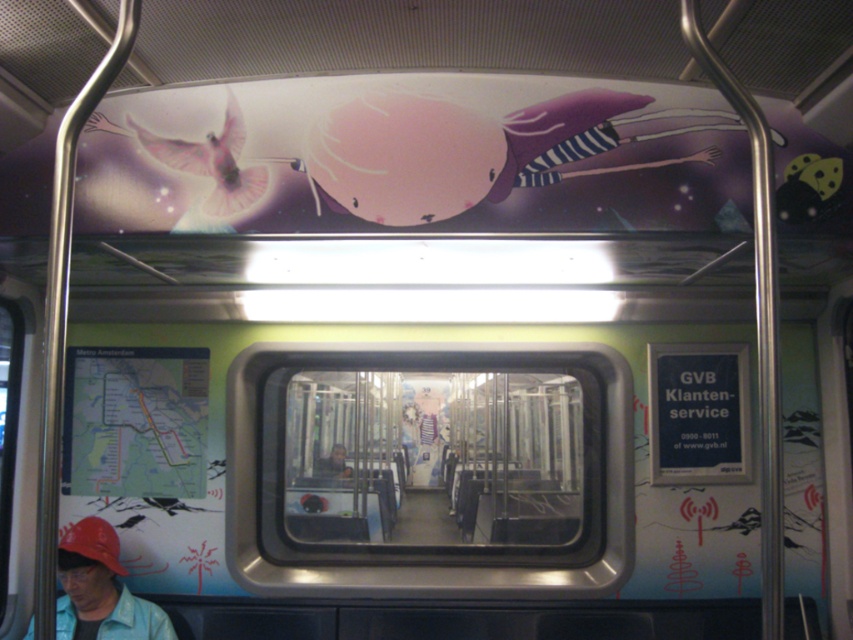
You are a passenger on the subway train and notice two items at the lower left corner. Which item is closer to you between the matte red hat at lower left and the matte red baseball cap at lower left?

The matte red hat at lower left is closer to you because it is in front of the matte red baseball cap at lower left.

You are a passenger on the subway train and want to find the customer service sign. You see a point marked at coordinates (100, 589). Which object is located at that point?

The point at coordinates (100, 589) corresponds to the matte red hat at lower left.

You are a passenger on the subway train and want to locate the matte red hat at lower left. Based on the coordinates provided, where exactly would you find it?

The matte red hat at lower left is located at point (100, 589), which means it is positioned near the bottom left corner of the train interior.